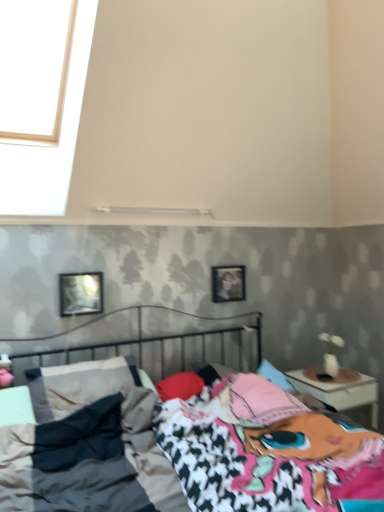
What do you see at coordinates (81, 293) in the screenshot? I see `metallic reflective picture frame at upper left, the second picture frame from the right` at bounding box center [81, 293].

Describe the element at coordinates (228, 283) in the screenshot. I see `wooden frame at center, arranged as the 1th picture frame when viewed from the right` at that location.

What is the approximate height of wooden frame at center, marked as the second picture frame in a left-to-right arrangement?

The height of wooden frame at center, marked as the second picture frame in a left-to-right arrangement, is 11.44 inches.

At what (x,y) coordinates should I click in order to perform the action: click on metallic reflective picture frame at upper left, marked as the 1th picture frame in a front-to-back arrangement. Please return your answer as a coordinate pair (x, y). Looking at the image, I should click on (81, 293).

Is metallic reflective picture frame at upper left, marked as the 1th picture frame in a left-to-right arrangement, outside of metallic bed at center?

Yes, metallic reflective picture frame at upper left, marked as the 1th picture frame in a left-to-right arrangement, is outside of metallic bed at center.

Can you confirm if metallic reflective picture frame at upper left, marked as the 1th picture frame in a left-to-right arrangement, is bigger than metallic bed at center?

No, metallic reflective picture frame at upper left, marked as the 1th picture frame in a left-to-right arrangement, is not bigger than metallic bed at center.

Does metallic reflective picture frame at upper left, marked as the 1th picture frame in a front-to-back arrangement, appear on the right side of metallic bed at center?

No.

From the image's perspective, between metallic reflective picture frame at upper left, the 2th picture frame viewed from the back, and metallic bed at center, who is located below?

From the image's view, metallic bed at center is below.

What are the coordinates of `nightstand located below the wooden frame at center, marked as the second picture frame in a left-to-right arrangement (from the image's perspective)` in the screenshot? It's located at [x=339, y=389].

Which is in front, white glossy nightstand at right or wooden frame at center, arranged as the 1th picture frame when viewed from the right?

white glossy nightstand at right is more forward.

Based on the photo, which of these two, white glossy nightstand at right or wooden frame at center, marked as the second picture frame in a left-to-right arrangement, is thinner?

Thinner between the two is wooden frame at center, marked as the second picture frame in a left-to-right arrangement.

Would you say white glossy nightstand at right is outside metallic reflective picture frame at upper left, marked as the 1th picture frame in a left-to-right arrangement?

Indeed, white glossy nightstand at right is completely outside metallic reflective picture frame at upper left, marked as the 1th picture frame in a left-to-right arrangement.

Considering the sizes of objects white glossy nightstand at right and metallic reflective picture frame at upper left, marked as the 1th picture frame in a left-to-right arrangement, in the image provided, who is shorter, white glossy nightstand at right or metallic reflective picture frame at upper left, marked as the 1th picture frame in a left-to-right arrangement,?

metallic reflective picture frame at upper left, marked as the 1th picture frame in a left-to-right arrangement.

How different are the orientations of white glossy nightstand at right and metallic reflective picture frame at upper left, marked as the 1th picture frame in a front-to-back arrangement, in degrees?

The angle between the facing direction of white glossy nightstand at right and the facing direction of metallic reflective picture frame at upper left, marked as the 1th picture frame in a front-to-back arrangement, is 0.104 degrees.

From a real-world perspective, which is physically above, metallic bed at center or metallic reflective picture frame at upper left, the second picture frame from the right?

metallic reflective picture frame at upper left, the second picture frame from the right, from a real-world perspective.

Looking at this image, does metallic bed at center have a lesser width compared to metallic reflective picture frame at upper left, marked as the 1th picture frame in a front-to-back arrangement?

No.

I want to click on the 1st picture frame behind the metallic bed at center, counting from the anchor's position, so click(x=81, y=293).

Are metallic bed at center and metallic reflective picture frame at upper left, marked as the 1th picture frame in a front-to-back arrangement, beside each other?

No, metallic bed at center is not beside metallic reflective picture frame at upper left, marked as the 1th picture frame in a front-to-back arrangement.

Which is closer, [244,267] or [72,302]?

Point [244,267] appears to be farther away from the viewer than point [72,302].

In order to click on picture frame lying above the metallic reflective picture frame at upper left, the second picture frame from the right (from the image's perspective) in this screenshot , I will do `click(228, 283)`.

Between wooden frame at center, which ranks as the second picture frame in front-to-back order, and metallic reflective picture frame at upper left, marked as the 1th picture frame in a left-to-right arrangement, which one has smaller size?

wooden frame at center, which ranks as the second picture frame in front-to-back order.

Where is `bed above the white glossy nightstand at right (from the image's perspective)`? The width and height of the screenshot is (384, 512). bed above the white glossy nightstand at right (from the image's perspective) is located at coordinates (180, 447).

Considering the relative positions of white glossy nightstand at right and metallic bed at center in the image provided, is white glossy nightstand at right behind metallic bed at center?

Yes.

Considering the sizes of objects white glossy nightstand at right and metallic bed at center in the image provided, who is wider, white glossy nightstand at right or metallic bed at center?

metallic bed at center.

Is white glossy nightstand at right with metallic bed at center?

No, white glossy nightstand at right is not making contact with metallic bed at center.

At what (x,y) coordinates should I click in order to perform the action: click on picture frame above the metallic reflective picture frame at upper left, marked as the 1th picture frame in a front-to-back arrangement (from the image's perspective). Please return your answer as a coordinate pair (x, y). The height and width of the screenshot is (512, 384). Looking at the image, I should click on (228, 283).

Is metallic reflective picture frame at upper left, marked as the 1th picture frame in a left-to-right arrangement, smaller than wooden frame at center, arranged as the 1th picture frame when viewed from the right?

Actually, metallic reflective picture frame at upper left, marked as the 1th picture frame in a left-to-right arrangement, might be larger than wooden frame at center, arranged as the 1th picture frame when viewed from the right.

From a real-world perspective, between metallic reflective picture frame at upper left, marked as the 1th picture frame in a left-to-right arrangement, and wooden frame at center, arranged as the 1th picture frame when viewed from the right, who is vertically lower?

In real-world perspective, metallic reflective picture frame at upper left, marked as the 1th picture frame in a left-to-right arrangement, is lower.

Is metallic reflective picture frame at upper left, the 2th picture frame viewed from the back, in front of wooden frame at center, placed as the first picture frame when sorted from back to front?

Yes, it is.

Identify the location of bed below the metallic reflective picture frame at upper left, marked as the 1th picture frame in a front-to-back arrangement (from a real-world perspective). The height and width of the screenshot is (512, 384). (180, 447).

At what (x,y) coordinates should I click in order to perform the action: click on nightstand below the wooden frame at center, marked as the second picture frame in a left-to-right arrangement (from the image's perspective). Please return your answer as a coordinate pair (x, y). Looking at the image, I should click on (339, 389).

When comparing their distances from metallic bed at center, does white glossy nightstand at right or metallic reflective picture frame at upper left, marked as the 1th picture frame in a front-to-back arrangement, seem further?

metallic reflective picture frame at upper left, marked as the 1th picture frame in a front-to-back arrangement.

From the image, which object appears to be farther from metallic bed at center, metallic reflective picture frame at upper left, the second picture frame from the right, or white glossy nightstand at right?

Based on the image, metallic reflective picture frame at upper left, the second picture frame from the right, appears to be further to metallic bed at center.

Which object lies nearer to the anchor point metallic reflective picture frame at upper left, the second picture frame from the right, wooden frame at center, marked as the second picture frame in a left-to-right arrangement, or metallic bed at center?

The object closer to metallic reflective picture frame at upper left, the second picture frame from the right, is metallic bed at center.

Which object lies further to the anchor point wooden frame at center, which ranks as the second picture frame in front-to-back order, metallic reflective picture frame at upper left, the 2th picture frame viewed from the back, or metallic bed at center?

Based on the image, metallic bed at center appears to be further to wooden frame at center, which ranks as the second picture frame in front-to-back order.

Looking at the image, which one is located closer to white glossy nightstand at right, wooden frame at center, which ranks as the second picture frame in front-to-back order, or metallic reflective picture frame at upper left, marked as the 1th picture frame in a left-to-right arrangement?

Based on the image, wooden frame at center, which ranks as the second picture frame in front-to-back order, appears to be nearer to white glossy nightstand at right.

Based on their spatial positions, is metallic bed at center or white glossy nightstand at right further from wooden frame at center, which ranks as the second picture frame in front-to-back order?

Based on the image, metallic bed at center appears to be further to wooden frame at center, which ranks as the second picture frame in front-to-back order.

From the picture: Which object lies further to the anchor point white glossy nightstand at right, wooden frame at center, placed as the first picture frame when sorted from back to front, or metallic bed at center?

metallic bed at center.

When comparing their distances from metallic bed at center, does white glossy nightstand at right or wooden frame at center, marked as the second picture frame in a left-to-right arrangement, seem closer?

white glossy nightstand at right is positioned closer to the anchor metallic bed at center.

This screenshot has width=384, height=512. I want to click on picture frame between metallic bed at center and white glossy nightstand at right along the z-axis, so click(81, 293).

Identify the location of picture frame between metallic reflective picture frame at upper left, marked as the 1th picture frame in a left-to-right arrangement, and white glossy nightstand at right from left to right. (228, 283).

Find the location of a particular element. picture frame between metallic bed at center and wooden frame at center, arranged as the 1th picture frame when viewed from the right, along the z-axis is located at coordinates (81, 293).

Locate an element on the screen. This screenshot has width=384, height=512. nightstand positioned between metallic bed at center and wooden frame at center, placed as the first picture frame when sorted from back to front, from near to far is located at coordinates click(339, 389).